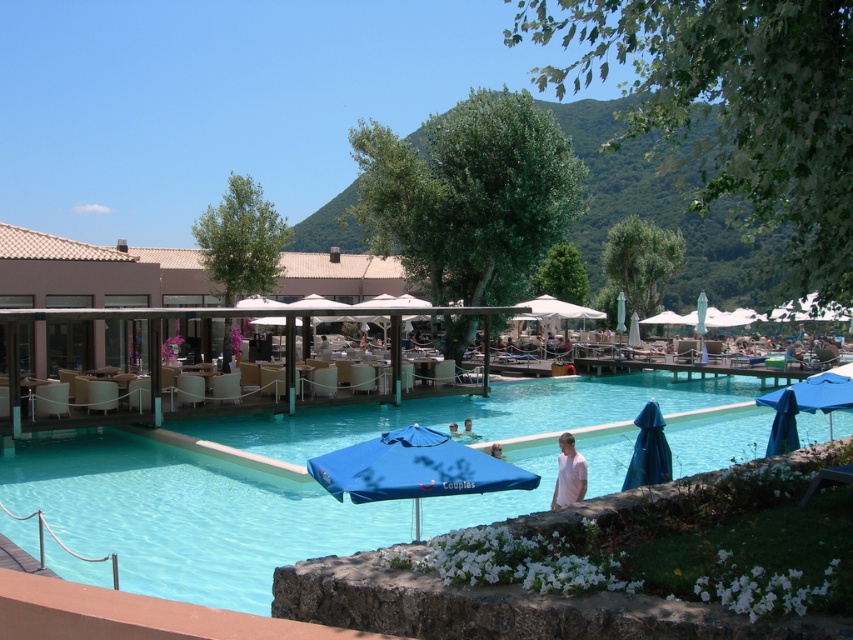
Based on the photo, which is more to the right, blue fabric umbrella at lower center or blue fabric umbrella at lower right?

blue fabric umbrella at lower right is more to the right.

Can you confirm if blue fabric umbrella at lower center is wider than blue fabric umbrella at lower right?

Incorrect, blue fabric umbrella at lower center's width does not surpass blue fabric umbrella at lower right's.

Identify the location of blue fabric umbrella at lower center. The width and height of the screenshot is (853, 640). [413, 468].

Can you confirm if matte beige patio furniture at center is positioned below blue fabric umbrella at lower center?

No, matte beige patio furniture at center is not below blue fabric umbrella at lower center.

Which is behind, point (138, 272) or point (473, 476)?

Positioned behind is point (138, 272).

Find the location of a particular element. This screenshot has height=640, width=853. matte beige patio furniture at center is located at coordinates (96, 275).

Which is below, smooth skin person at lower center or light blue fabric umbrella at center?

Positioned lower is smooth skin person at lower center.

Does smooth skin person at lower center have a greater width compared to light blue fabric umbrella at center?

Yes.

Is point (489, 451) positioned behind point (451, 422)?

No, (489, 451) is closer to viewer.

You are a GUI agent. You are given a task and a screenshot of the screen. Output one action in this format:
    pyautogui.click(x=<x>, y=<y>)
    Task: Click on the smooth skin person at lower center
    The image size is (853, 640).
    Given the screenshot: What is the action you would take?
    pyautogui.click(x=496, y=451)